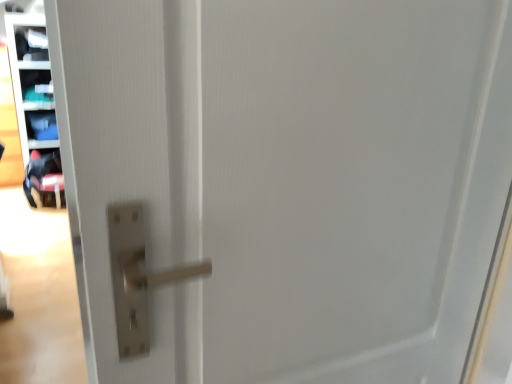
At what (x,y) coordinates should I click in order to perform the action: click on matte plastic shelf at upper left, which is the 2th shelf in bottom-to-top order. Please return your answer as a coordinate pair (x, y). Looking at the image, I should click on (34, 105).

Describe the element at coordinates (34, 105) in the screenshot. I see `matte plastic shelf at upper left, which is the 2th shelf in bottom-to-top order` at that location.

I want to click on matte plastic shelf at upper left, the 2th shelf viewed from the top, so pyautogui.click(x=35, y=88).

Measure the distance between point [22,71] and camera.

Point [22,71] is 3.80 meters from camera.

I want to click on matte plastic shelf at left, placed as the fourth shelf when sorted from top to bottom, so click(41, 125).

This screenshot has width=512, height=384. What are the coordinates of `matte plastic shelf at upper left, the third shelf when ordered from top to bottom` in the screenshot? It's located at (34, 105).

Is matte plastic shelf at left, placed as the fourth shelf when sorted from top to bottom, positioned far away from matte plastic shelf at upper left, which ranks as the 3th shelf in bottom-to-top order?

matte plastic shelf at left, placed as the fourth shelf when sorted from top to bottom, is actually quite close to matte plastic shelf at upper left, which ranks as the 3th shelf in bottom-to-top order.

Does matte plastic shelf at left, arranged as the first shelf when ordered from the bottom, have a lesser width compared to matte plastic shelf at upper left, the 2th shelf viewed from the top?

Yes.

From the image's perspective, is matte plastic shelf at left, placed as the fourth shelf when sorted from top to bottom, above matte plastic shelf at upper left, the 2th shelf viewed from the top?

No.

Consider the image. From the image's perspective, is matte plastic shelf at upper left, the 2th shelf viewed from the top, beneath matte plastic shelf at upper left, the first shelf positioned from the top?

Yes, from the image's perspective, matte plastic shelf at upper left, the 2th shelf viewed from the top, is beneath matte plastic shelf at upper left, the first shelf positioned from the top.

From their relative heights in the image, would you say matte plastic shelf at upper left, which ranks as the 3th shelf in bottom-to-top order, is taller or shorter than matte plastic shelf at upper left, the first shelf positioned from the top?

matte plastic shelf at upper left, which ranks as the 3th shelf in bottom-to-top order, is shorter than matte plastic shelf at upper left, the first shelf positioned from the top.

Is matte plastic shelf at upper left, the 2th shelf viewed from the top, facing away from matte plastic shelf at upper left, the fourth shelf ordered from the bottom?

No, matte plastic shelf at upper left, the fourth shelf ordered from the bottom, is not at the back of matte plastic shelf at upper left, the 2th shelf viewed from the top.

Does matte plastic shelf at upper left, the 2th shelf viewed from the top, have a lesser width compared to matte plastic shelf at upper left, the fourth shelf ordered from the bottom?

In fact, matte plastic shelf at upper left, the 2th shelf viewed from the top, might be wider than matte plastic shelf at upper left, the fourth shelf ordered from the bottom.

Can you confirm if matte plastic shelf at upper left, the 2th shelf viewed from the top, is wider than matte plastic shelf at upper left, which is the 2th shelf in bottom-to-top order?

In fact, matte plastic shelf at upper left, the 2th shelf viewed from the top, might be narrower than matte plastic shelf at upper left, which is the 2th shelf in bottom-to-top order.

Between matte plastic shelf at upper left, the 2th shelf viewed from the top, and matte plastic shelf at upper left, which is the 2th shelf in bottom-to-top order, which one has more height?

With more height is matte plastic shelf at upper left, which is the 2th shelf in bottom-to-top order.

From the picture: From the image's perspective, is matte plastic shelf at upper left, which ranks as the 3th shelf in bottom-to-top order, located beneath matte plastic shelf at upper left, which is the 2th shelf in bottom-to-top order?

No.

What's the angular difference between matte plastic shelf at upper left, which ranks as the 3th shelf in bottom-to-top order, and matte plastic shelf at upper left, the third shelf when ordered from top to bottom,'s facing directions?

The facing directions of matte plastic shelf at upper left, which ranks as the 3th shelf in bottom-to-top order, and matte plastic shelf at upper left, the third shelf when ordered from top to bottom, are 1.14 degrees apart.

From a real-world perspective, between matte plastic shelf at upper left, the fourth shelf ordered from the bottom, and matte plastic shelf at upper left, which is the 2th shelf in bottom-to-top order, who is vertically lower?

From a 3D spatial view, matte plastic shelf at upper left, which is the 2th shelf in bottom-to-top order, is below.

Which of these two, matte plastic shelf at upper left, the fourth shelf ordered from the bottom, or matte plastic shelf at upper left, which is the 2th shelf in bottom-to-top order, stands taller?

Standing taller between the two is matte plastic shelf at upper left, which is the 2th shelf in bottom-to-top order.

Is matte plastic shelf at upper left, the first shelf positioned from the top, thinner than matte plastic shelf at upper left, which is the 2th shelf in bottom-to-top order?

Yes, matte plastic shelf at upper left, the first shelf positioned from the top, is thinner than matte plastic shelf at upper left, which is the 2th shelf in bottom-to-top order.

Would you say matte plastic shelf at upper left, the first shelf positioned from the top, contains matte plastic shelf at upper left, the third shelf when ordered from top to bottom?

No, matte plastic shelf at upper left, the third shelf when ordered from top to bottom, is located outside of matte plastic shelf at upper left, the first shelf positioned from the top.

From a real-world perspective, is matte plastic shelf at left, arranged as the first shelf when ordered from the bottom, physically above matte plastic shelf at upper left, which is the 2th shelf in bottom-to-top order?

No, from a real-world perspective, matte plastic shelf at left, arranged as the first shelf when ordered from the bottom, is not over matte plastic shelf at upper left, which is the 2th shelf in bottom-to-top order

From their relative heights in the image, would you say matte plastic shelf at left, placed as the fourth shelf when sorted from top to bottom, is taller or shorter than matte plastic shelf at upper left, which is the 2th shelf in bottom-to-top order?

Clearly, matte plastic shelf at left, placed as the fourth shelf when sorted from top to bottom, is shorter compared to matte plastic shelf at upper left, which is the 2th shelf in bottom-to-top order.

This screenshot has height=384, width=512. What are the coordinates of `shelf below the matte plastic shelf at upper left, which is the 2th shelf in bottom-to-top order (from the image's perspective)` in the screenshot? It's located at (41, 125).

Is matte plastic shelf at upper left, the 2th shelf viewed from the top, in front of matte plastic shelf at left, placed as the fourth shelf when sorted from top to bottom?

Yes, it is.

Considering the sizes of objects matte plastic shelf at upper left, which ranks as the 3th shelf in bottom-to-top order, and matte plastic shelf at left, placed as the fourth shelf when sorted from top to bottom, in the image provided, who is wider, matte plastic shelf at upper left, which ranks as the 3th shelf in bottom-to-top order, or matte plastic shelf at left, placed as the fourth shelf when sorted from top to bottom,?

matte plastic shelf at upper left, which ranks as the 3th shelf in bottom-to-top order, is wider.

Measure the distance between matte plastic shelf at upper left, which ranks as the 3th shelf in bottom-to-top order, and matte plastic shelf at left, arranged as the first shelf when ordered from the bottom.

A distance of 8.30 inches exists between matte plastic shelf at upper left, which ranks as the 3th shelf in bottom-to-top order, and matte plastic shelf at left, arranged as the first shelf when ordered from the bottom.

Could matte plastic shelf at left, placed as the fourth shelf when sorted from top to bottom, be considered to be inside matte plastic shelf at upper left, the 2th shelf viewed from the top?

No, matte plastic shelf at left, placed as the fourth shelf when sorted from top to bottom, is located outside of matte plastic shelf at upper left, the 2th shelf viewed from the top.

From the image's perspective, is matte plastic shelf at upper left, the fourth shelf ordered from the bottom, located above or below matte plastic shelf at left, arranged as the first shelf when ordered from the bottom?

Based on their image positions, matte plastic shelf at upper left, the fourth shelf ordered from the bottom, is located above matte plastic shelf at left, arranged as the first shelf when ordered from the bottom.

In terms of height, does matte plastic shelf at upper left, the first shelf positioned from the top, look taller or shorter compared to matte plastic shelf at left, arranged as the first shelf when ordered from the bottom?

Clearly, matte plastic shelf at upper left, the first shelf positioned from the top, is taller compared to matte plastic shelf at left, arranged as the first shelf when ordered from the bottom.

Is matte plastic shelf at upper left, the first shelf positioned from the top, bigger or smaller than matte plastic shelf at left, arranged as the first shelf when ordered from the bottom?

In the image, matte plastic shelf at upper left, the first shelf positioned from the top, appears to be larger than matte plastic shelf at left, arranged as the first shelf when ordered from the bottom.

Is matte plastic shelf at upper left, the fourth shelf ordered from the bottom, located outside matte plastic shelf at left, placed as the fourth shelf when sorted from top to bottom?

Yes.

From a real-world perspective, which shelf is the 2nd one above the matte plastic shelf at left, arranged as the first shelf when ordered from the bottom? Please provide its 2D coordinates.

[(35, 88)]

Starting from the matte plastic shelf at upper left, which ranks as the 3th shelf in bottom-to-top order, which shelf is the 1st one in front? Please provide its 2D coordinates.

[(31, 43)]

Estimate the real-world distances between objects in this image. Which object is further from matte plastic shelf at left, arranged as the first shelf when ordered from the bottom, matte plastic shelf at upper left, the first shelf positioned from the top, or matte plastic shelf at upper left, which is the 2th shelf in bottom-to-top order?

Among the two, matte plastic shelf at upper left, the first shelf positioned from the top, is located further to matte plastic shelf at left, arranged as the first shelf when ordered from the bottom.

From the image, which object appears to be nearer to matte plastic shelf at upper left, which ranks as the 3th shelf in bottom-to-top order, matte plastic shelf at left, arranged as the first shelf when ordered from the bottom, or matte plastic shelf at upper left, the third shelf when ordered from top to bottom?

matte plastic shelf at left, arranged as the first shelf when ordered from the bottom, lies closer to matte plastic shelf at upper left, which ranks as the 3th shelf in bottom-to-top order, than the other object.

Which object lies nearer to the anchor point matte plastic shelf at left, arranged as the first shelf when ordered from the bottom, matte plastic shelf at upper left, which ranks as the 3th shelf in bottom-to-top order, or matte plastic shelf at upper left, which is the 2th shelf in bottom-to-top order?

Among the two, matte plastic shelf at upper left, which ranks as the 3th shelf in bottom-to-top order, is located nearer to matte plastic shelf at left, arranged as the first shelf when ordered from the bottom.

Looking at the image, which one is located closer to matte plastic shelf at upper left, the first shelf positioned from the top, matte plastic shelf at left, arranged as the first shelf when ordered from the bottom, or matte plastic shelf at upper left, which is the 2th shelf in bottom-to-top order?

Based on the image, matte plastic shelf at upper left, which is the 2th shelf in bottom-to-top order, appears to be nearer to matte plastic shelf at upper left, the first shelf positioned from the top.

When comparing their distances from matte plastic shelf at upper left, the fourth shelf ordered from the bottom, does matte plastic shelf at upper left, which ranks as the 3th shelf in bottom-to-top order, or matte plastic shelf at left, placed as the fourth shelf when sorted from top to bottom, seem further?

matte plastic shelf at left, placed as the fourth shelf when sorted from top to bottom, lies further to matte plastic shelf at upper left, the fourth shelf ordered from the bottom, than the other object.

Which object lies further to the anchor point matte plastic shelf at upper left, the fourth shelf ordered from the bottom, matte plastic shelf at left, placed as the fourth shelf when sorted from top to bottom, or matte plastic shelf at upper left, the 2th shelf viewed from the top?

matte plastic shelf at left, placed as the fourth shelf when sorted from top to bottom, lies further to matte plastic shelf at upper left, the fourth shelf ordered from the bottom, than the other object.

From the image, which object appears to be farther from matte plastic shelf at upper left, the third shelf when ordered from top to bottom, matte plastic shelf at upper left, which ranks as the 3th shelf in bottom-to-top order, or matte plastic shelf at upper left, the first shelf positioned from the top?

The object further to matte plastic shelf at upper left, the third shelf when ordered from top to bottom, is matte plastic shelf at upper left, the first shelf positioned from the top.

Looking at the image, which one is located further to matte plastic shelf at upper left, the first shelf positioned from the top, matte plastic shelf at upper left, the third shelf when ordered from top to bottom, or matte plastic shelf at upper left, the 2th shelf viewed from the top?

matte plastic shelf at upper left, the third shelf when ordered from top to bottom, lies further to matte plastic shelf at upper left, the first shelf positioned from the top, than the other object.

You are a GUI agent. You are given a task and a screenshot of the screen. Output one action in this format:
    pyautogui.click(x=<x>, y=<y>)
    Task: Click on the shelf that lies between matte plastic shelf at upper left, the first shelf positioned from the top, and matte plastic shelf at upper left, which is the 2th shelf in bottom-to-top order, from top to bottom
    This screenshot has width=512, height=384.
    Given the screenshot: What is the action you would take?
    pyautogui.click(x=35, y=88)

Find the location of a particular element. This screenshot has height=384, width=512. shelf that lies between matte plastic shelf at upper left, the 2th shelf viewed from the top, and matte plastic shelf at left, placed as the fourth shelf when sorted from top to bottom, from top to bottom is located at coordinates (34, 105).